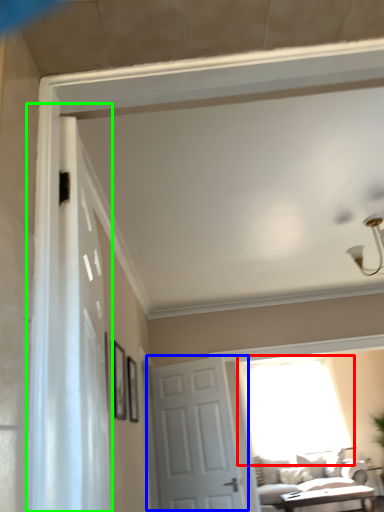
Question: Based on their relative distances, which object is nearer to window (highlighted by a red box)? Choose from door (highlighted by a blue box) and shower curtain (highlighted by a green box).

Choices:
 (A) door
 (B) shower curtain

Answer: (A)